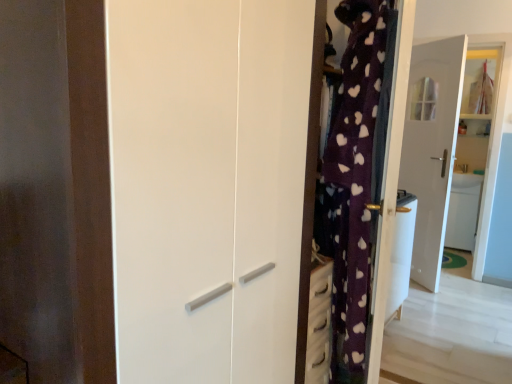
What do you see at coordinates (432, 147) in the screenshot?
I see `white glossy door at center` at bounding box center [432, 147].

Find the location of a particular element. white glossy wardrobe at center is located at coordinates (207, 185).

This screenshot has width=512, height=384. Identify the location of white glossy sink at right. pyautogui.click(x=466, y=180).

The width and height of the screenshot is (512, 384). I want to click on white glossy door at center, so click(432, 147).

How many degrees apart are the facing directions of white glossy sink at right and white glossy door at center?

49.1 degrees separate the facing orientations of white glossy sink at right and white glossy door at center.

Where is `counter top below the white glossy door at center (from a real-world perspective)`? counter top below the white glossy door at center (from a real-world perspective) is located at coordinates (466, 180).

From the image's perspective, which one is positioned higher, white glossy sink at right or white glossy door at center?

white glossy door at center appears higher in the image.

Between white glossy sink at right and white glossy wardrobe at center, which one has smaller width?

white glossy sink at right is thinner.

This screenshot has width=512, height=384. What are the coordinates of `screen door on the left of white glossy sink at right` in the screenshot? It's located at (207, 185).

Visually, is white glossy sink at right positioned to the left or to the right of white glossy wardrobe at center?

From the image, it's evident that white glossy sink at right is to the right of white glossy wardrobe at center.

Which object is further away from the camera taking this photo, white glossy sink at right or white glossy wardrobe at center?

white glossy sink at right is further from the camera.

Which is more to the left, white glossy door at center or white glossy wardrobe at center?

Positioned to the left is white glossy wardrobe at center.

Image resolution: width=512 pixels, height=384 pixels. I want to click on door above the white glossy wardrobe at center (from the image's perspective), so click(432, 147).

Can you confirm if white glossy door at center is thinner than white glossy wardrobe at center?

Indeed, white glossy door at center has a lesser width compared to white glossy wardrobe at center.

How much distance is there between white glossy wardrobe at center and white glossy sink at right?

white glossy wardrobe at center and white glossy sink at right are 3.73 meters apart.

Is white glossy wardrobe at center not close to white glossy sink at right?

Yes, white glossy wardrobe at center and white glossy sink at right are quite far apart.

Can you confirm if white glossy wardrobe at center is shorter than white glossy sink at right?

Incorrect, the height of white glossy wardrobe at center does not fall short of that of white glossy sink at right.

Which of these two, white glossy door at center or white glossy sink at right, stands shorter?

Standing shorter between the two is white glossy sink at right.

The height and width of the screenshot is (384, 512). Identify the location of counter top behind the white glossy door at center. (466, 180).

From the image's perspective, which is below, white glossy door at center or white glossy sink at right?

white glossy sink at right.

Could you tell me if white glossy door at center is turned towards white glossy sink at right?

No, white glossy door at center is not aimed at white glossy sink at right.

Is white glossy wardrobe at center completely or partially outside of white glossy door at center?

Indeed, white glossy wardrobe at center is completely outside white glossy door at center.

Does point (297, 265) come closer to viewer compared to point (410, 103)?

That is True.

From a real-world perspective, is white glossy wardrobe at center below white glossy door at center?

Yes, from a real-world perspective, white glossy wardrobe at center is beneath white glossy door at center.

In terms of width, does white glossy wardrobe at center look wider or thinner when compared to white glossy door at center?

Clearly, white glossy wardrobe at center has more width compared to white glossy door at center.

Where is `counter top on the right of white glossy door at center`? counter top on the right of white glossy door at center is located at coordinates (466, 180).

Locate an element on the screen. Image resolution: width=512 pixels, height=384 pixels. screen door lying on the left of white glossy sink at right is located at coordinates (207, 185).

In the scene shown: Which object lies nearer to the anchor point white glossy door at center, white glossy wardrobe at center or white glossy sink at right?

white glossy sink at right lies closer to white glossy door at center than the other object.

Considering their positions, is white glossy door at center positioned further to white glossy wardrobe at center than white glossy sink at right?

white glossy sink at right is positioned further to the anchor white glossy wardrobe at center.

From the image, which object appears to be farther from white glossy wardrobe at center, white glossy sink at right or white glossy door at center?

The object further to white glossy wardrobe at center is white glossy sink at right.

Considering their positions, is white glossy wardrobe at center positioned further to white glossy sink at right than white glossy door at center?

white glossy wardrobe at center lies further to white glossy sink at right than the other object.

Estimate the real-world distances between objects in this image. Which object is closer to white glossy door at center, white glossy sink at right or white glossy wardrobe at center?

white glossy sink at right lies closer to white glossy door at center than the other object.

From the image, which object appears to be nearer to white glossy sink at right, white glossy door at center or white glossy wardrobe at center?

Among the two, white glossy door at center is located nearer to white glossy sink at right.

You are a GUI agent. You are given a task and a screenshot of the screen. Output one action in this format:
    pyautogui.click(x=<x>, y=<y>)
    Task: Click on the door located between white glossy wardrobe at center and white glossy sink at right in the depth direction
    The image size is (512, 384).
    Given the screenshot: What is the action you would take?
    pyautogui.click(x=432, y=147)